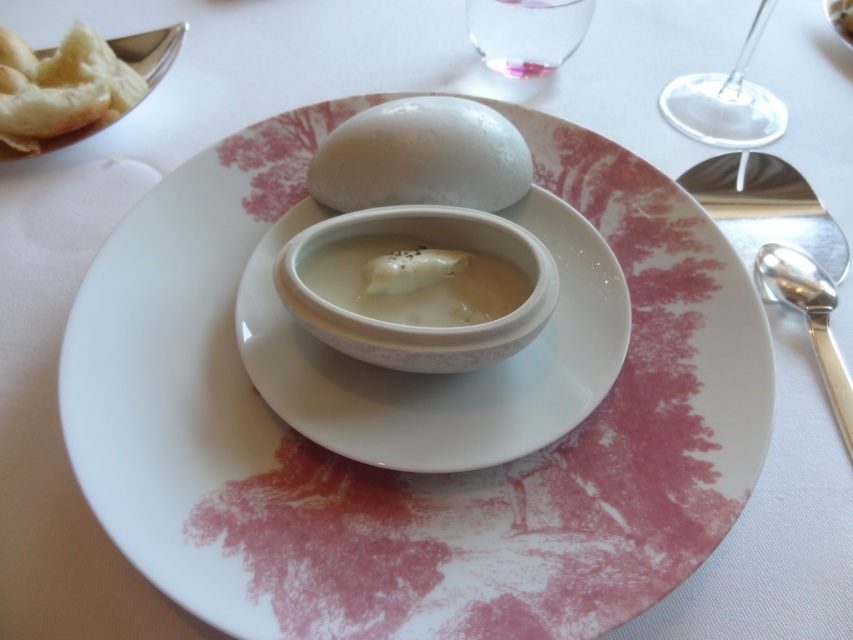
You are a chef preparing a dish and need to place both the white glossy plate at center and the white ceramic saucer at center on a shelf. The shelf has limited space, and you want to ensure the larger item is placed first to maximize stability. Which object should you place first?

The white glossy plate at center should be placed first because it has a larger size compared to the white ceramic saucer at center, ensuring stability on the shelf.

Looking at this image, you are a chef preparing a dish and need to ensure that the white creamy gravy at center fits on the white glossy plate at center. Based on the scene, can you confirm if the gravy will fit on the plate?

The white glossy plate at center has a larger size compared to the white creamy gravy at center, so the gravy will fit on the plate.